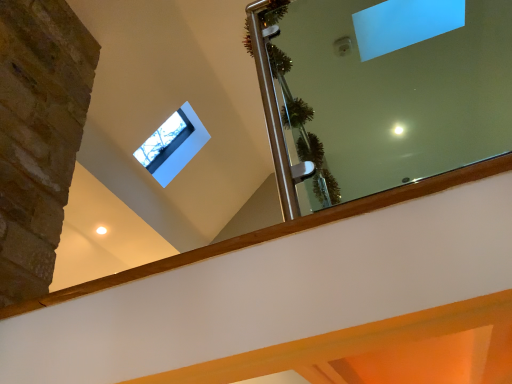
Question: Would you say clear glass mirror at upper center is inside or outside transparent glass window at upper center?

Choices:
 (A) inside
 (B) outside

Answer: (B)

Question: Does point (482, 1) appear closer or farther from the camera than point (167, 180)?

Choices:
 (A) farther
 (B) closer

Answer: (B)

Question: Is clear glass mirror at upper center wider or thinner than transparent glass window at upper center?

Choices:
 (A) wide
 (B) thin

Answer: (A)

Question: Does point (179, 134) appear closer or farther from the camera than point (310, 201)?

Choices:
 (A) closer
 (B) farther

Answer: (B)

Question: Is transparent glass window at upper center wider or thinner than clear glass mirror at upper center?

Choices:
 (A) thin
 (B) wide

Answer: (A)

Question: Is transparent glass window at upper center situated inside clear glass mirror at upper center or outside?

Choices:
 (A) inside
 (B) outside

Answer: (B)

Question: Based on their positions, is transparent glass window at upper center located to the left or right of clear glass mirror at upper center?

Choices:
 (A) left
 (B) right

Answer: (A)